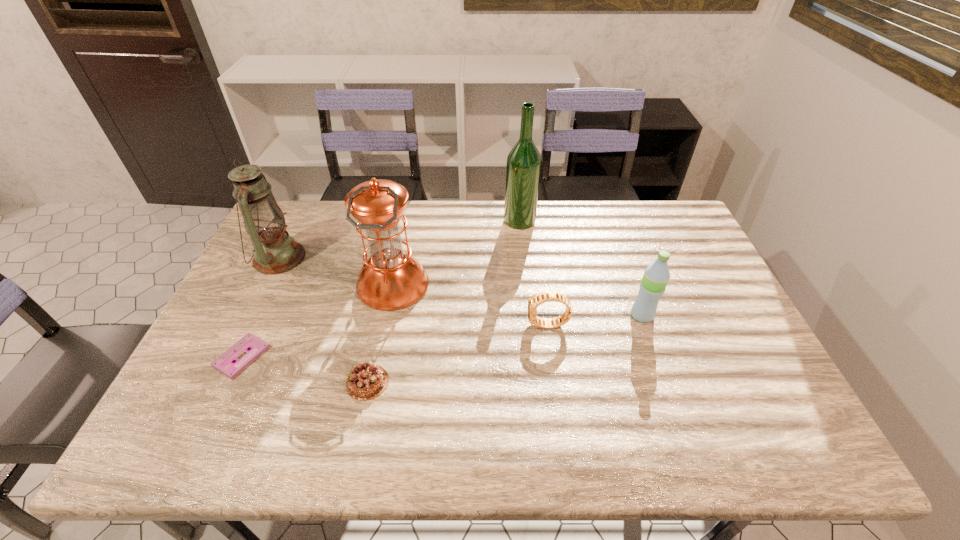
The width and height of the screenshot is (960, 540). In order to click on free spot that satisfies the following two spatial constraints: 1. on the face of the fifth tallest object; 2. on the front side of the chocolate cake in this screenshot , I will do `click(556, 382)`.